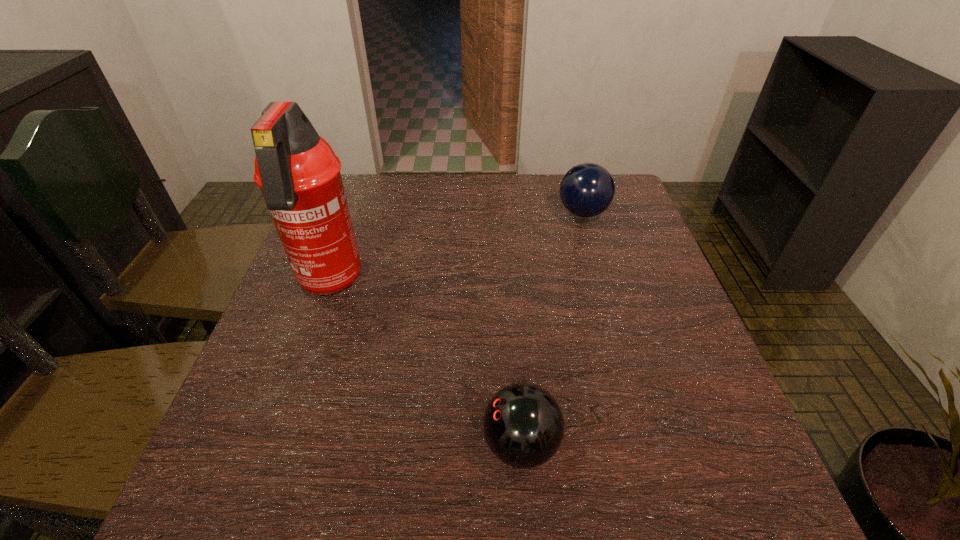
Identify the location of vacant space that satisfies the following two spatial constraints: 1. on the surface of the rightmost object near the finger holes; 2. on the trigger side of the second farthest object. The image size is (960, 540). (604, 283).